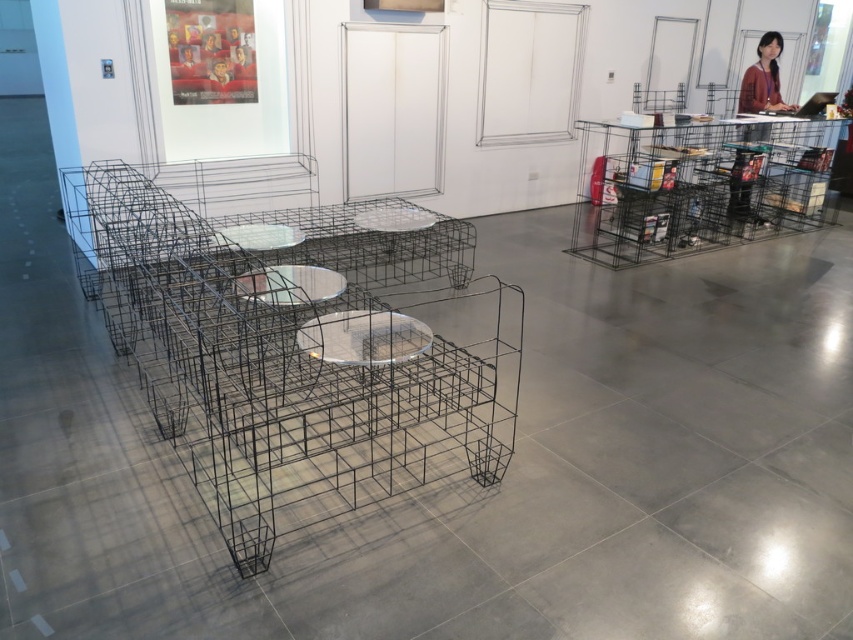
You are an interior designer planning to place a matte black jacket at upper right on the transparent glass table at center. Based on their sizes, will the jacket fit on the table?

The transparent glass table at center has a width less than the matte black jacket at upper right, so the jacket will not fit on the table.

You are an interior designer planning to place a new sculpture between the transparent glass table at center and the matte black jacket at upper right. Based on their positions, which object should the sculpture be closer to in order to maintain a balanced layout?

The transparent glass table at center is closer to the viewer than the matte black jacket at upper right, so placing the sculpture closer to the matte black jacket at upper right would help balance the layout by counteracting the forward position of the table.

You are an interior designer planning to place a potted plant between the transparent glass table at center and the clear glass table at center. According to the scene description, which table should the plant be placed closer to, the one above or below?

The transparent glass table at center is located below the clear glass table at center, so the plant should be placed closer to the clear glass table at center which is above.